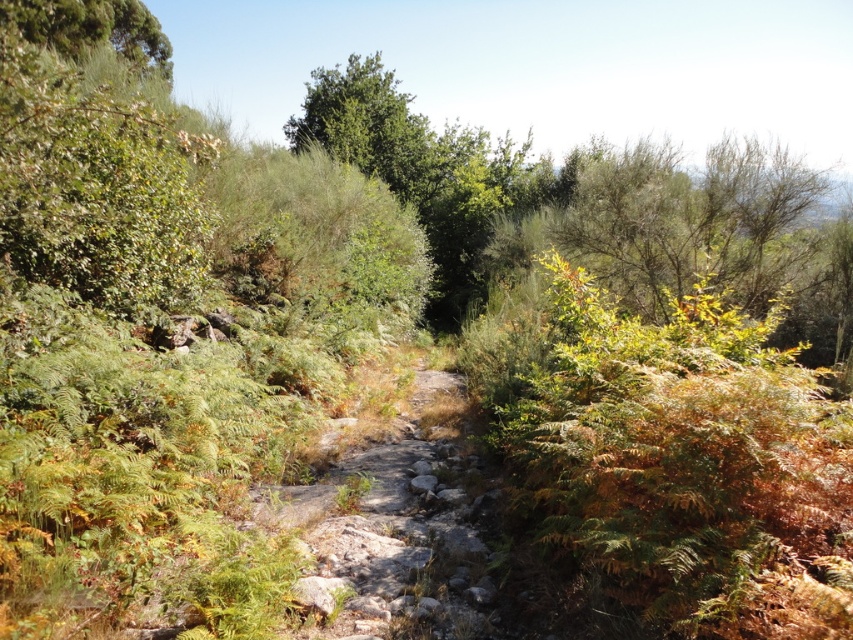
Based on the photo, between gray rocky trail at center and green leafy bush at upper right, which one has less height?

Standing shorter between the two is gray rocky trail at center.

Can you confirm if gray rocky trail at center is thinner than green leafy bush at upper right?

Yes.

Which is behind, point (415, 422) or point (577, 204)?

Point (577, 204)

Where is `gray rocky trail at center`? The width and height of the screenshot is (853, 640). gray rocky trail at center is located at coordinates (395, 529).

Which is below, gray rocky trail at center or green leafy tree at upper left?

gray rocky trail at center is below.

Is gray rocky trail at center smaller than green leafy tree at upper left?

Indeed, gray rocky trail at center has a smaller size compared to green leafy tree at upper left.

Between point (358, 611) and point (30, 20), which one is positioned behind?

The point (30, 20) is behind.

Find the location of a particular element. The image size is (853, 640). gray rocky trail at center is located at coordinates (395, 529).

Is the position of green leafy bush at upper right less distant than that of green leafy tree at upper left?

Yes.

Who is positioned more to the right, green leafy bush at upper right or green leafy tree at upper left?

Positioned to the right is green leafy bush at upper right.

Is point (670, 211) farther from viewer compared to point (79, 16)?

No, it is in front of (79, 16).

Find the location of a particular element. This screenshot has height=640, width=853. green leafy bush at upper right is located at coordinates (694, 221).